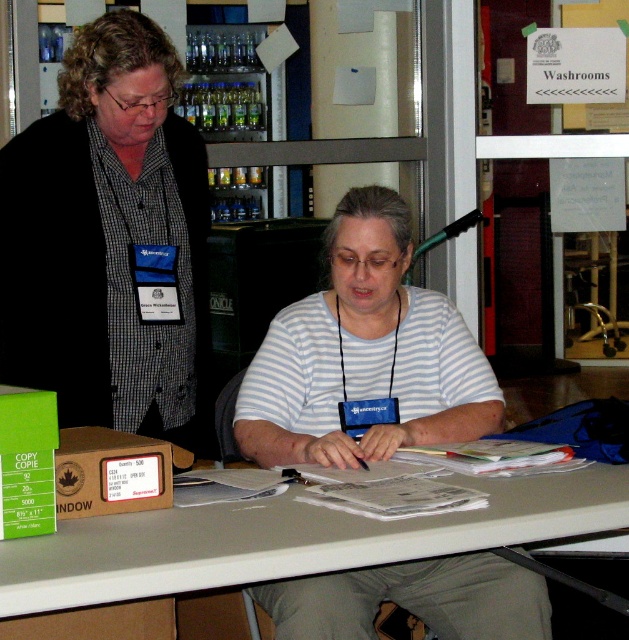
Question: Does smooth gray table at center appear under brown cardboard box at lower left?

Choices:
 (A) yes
 (B) no

Answer: (A)

Question: Which of the following is the closest to the observer?

Choices:
 (A) white striped shirt at center
 (B) brown cardboard box at lower left
 (C) checkered fabric shirt at left

Answer: (B)

Question: Which of the following is the closest to the observer?

Choices:
 (A) pos(40,371)
 (B) pos(114,493)
 (C) pos(89,532)
 (D) pos(404,384)

Answer: (C)

Question: Does checkered fabric shirt at left have a greater width compared to white striped shirt at center?

Choices:
 (A) yes
 (B) no

Answer: (B)

Question: Which of the following is the farthest from the observer?

Choices:
 (A) checkered fabric shirt at left
 (B) brown cardboard box at lower left
 (C) white striped shirt at center
 (D) smooth gray table at center

Answer: (A)

Question: Can you confirm if checkered fabric shirt at left is positioned above white striped shirt at center?

Choices:
 (A) no
 (B) yes

Answer: (B)